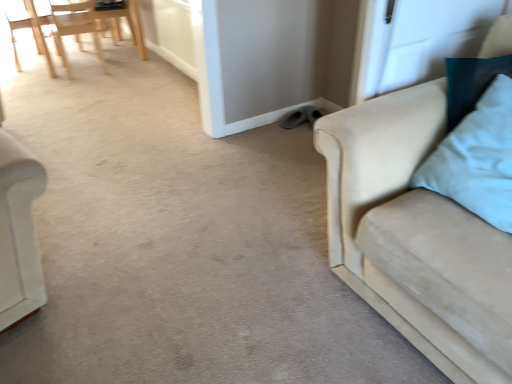
Question: Can you confirm if light wood chair at upper left, the third chair positioned from the left, is thinner than gray suede shoes at center?

Choices:
 (A) no
 (B) yes

Answer: (A)

Question: Is gray suede shoes at center at the back of light wood chair at upper left, the third chair positioned from the left?

Choices:
 (A) yes
 (B) no

Answer: (B)

Question: Is light wood chair at upper left, arranged as the first chair when viewed from the right, shorter than gray suede shoes at center?

Choices:
 (A) yes
 (B) no

Answer: (B)

Question: Is light wood chair at upper left, the third chair positioned from the left, at the left side of gray suede shoes at center?

Choices:
 (A) no
 (B) yes

Answer: (B)

Question: Is the position of light wood chair at upper left, arranged as the first chair when viewed from the right, less distant than that of gray suede shoes at center?

Choices:
 (A) yes
 (B) no

Answer: (B)

Question: Considering the relative sizes of light wood chair at upper left, arranged as the first chair when viewed from the right, and gray suede shoes at center in the image provided, is light wood chair at upper left, arranged as the first chair when viewed from the right, smaller than gray suede shoes at center?

Choices:
 (A) yes
 (B) no

Answer: (B)

Question: From a real-world perspective, is light wood chair at upper left, arranged as the first chair when viewed from the left, under suede beige couch at right?

Choices:
 (A) no
 (B) yes

Answer: (B)

Question: Can you confirm if light wood chair at upper left, arranged as the first chair when viewed from the left, is shorter than suede beige couch at right?

Choices:
 (A) yes
 (B) no

Answer: (A)

Question: Does light wood chair at upper left, the third chair viewed from the right, lie in front of suede beige couch at right?

Choices:
 (A) yes
 (B) no

Answer: (B)

Question: Can you confirm if light wood chair at upper left, the third chair viewed from the right, is thinner than suede beige couch at right?

Choices:
 (A) no
 (B) yes

Answer: (B)

Question: Is light wood chair at upper left, the third chair viewed from the right, touching suede beige couch at right?

Choices:
 (A) yes
 (B) no

Answer: (B)

Question: Is light wood chair at upper left, the third chair viewed from the right, to the left of suede beige couch at right from the viewer's perspective?

Choices:
 (A) no
 (B) yes

Answer: (B)

Question: From a real-world perspective, is gray suede shoes at center physically above light blue fabric pillow at right?

Choices:
 (A) no
 (B) yes

Answer: (A)